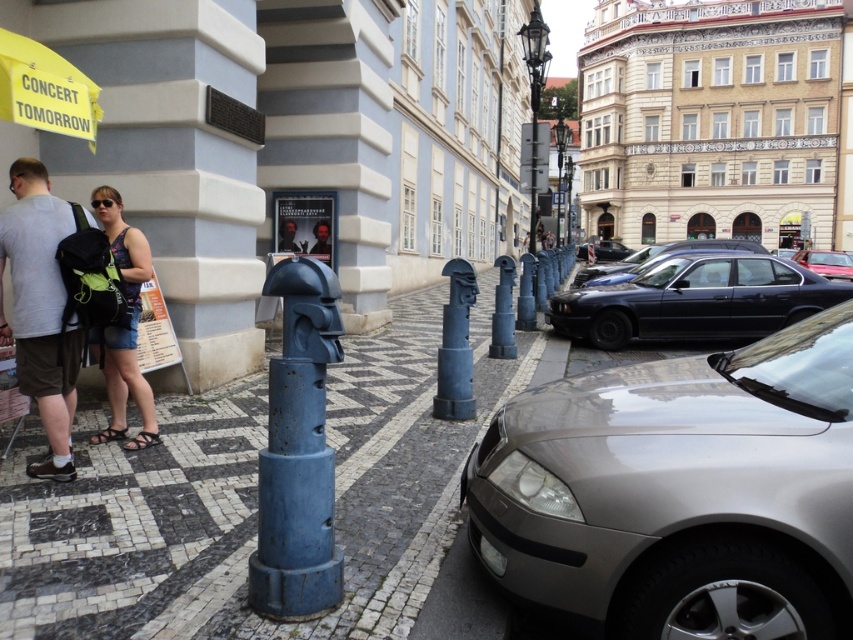
You are a delivery driver who needs to park your black glossy sedan at center in a spot that is not blocked by the yellow umbrella on the left. Is the parking spot at point (x=654, y=257) available?

The black glossy sedan at center is located at point (x=654, y=257), so the parking spot there is already occupied by the sedan and not available for parking.

You are a delivery person needing to place a package on the matte gray backpack at left. Can you place it there without moving the metallic silver car at center?

The metallic silver car at center is positioned under the matte gray backpack at left, so you cannot place the package there without moving the metallic silver car at center.

Consider the image. You are standing on the cobblestone street in the European city scene. You see a matte gray backpack at left. Can you reach it without moving from your current position?

The matte gray backpack at left is 4.54 meters away from viewer, so you cannot reach it without moving from your current position.